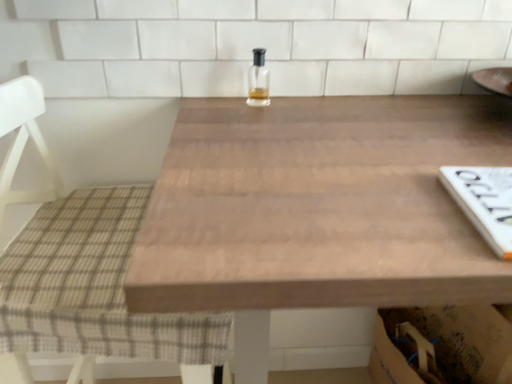
Find the location of a particular element. Image resolution: width=512 pixels, height=384 pixels. blank area to the left of clear glass bottle at center is located at coordinates (210, 107).